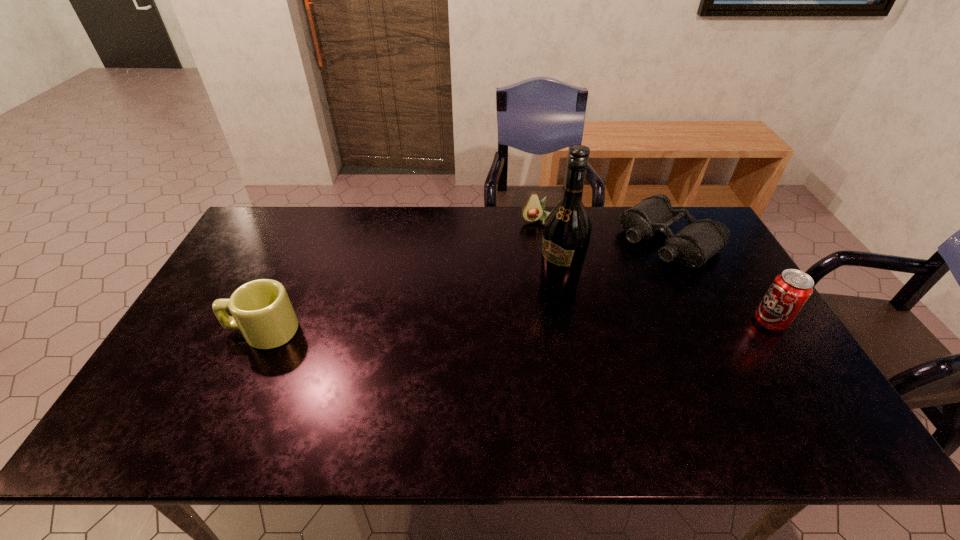
This screenshot has width=960, height=540. Find the location of `vacant space on the desktop that is between the leftmost object and the second tallest object and is positioned through the eyepieces of the binoculars`. vacant space on the desktop that is between the leftmost object and the second tallest object and is positioned through the eyepieces of the binoculars is located at coordinates (546, 326).

Locate an element on the screen. The image size is (960, 540). vacant space on the desktop that is between the leftmost object and the soda and is positioned on the seed side of the avocado is located at coordinates (571, 326).

This screenshot has height=540, width=960. In order to click on vacant space on the desktop that is between the leftmost object and the second tallest object and is positioned on the label of the wine bottle in this screenshot , I will do `click(517, 327)`.